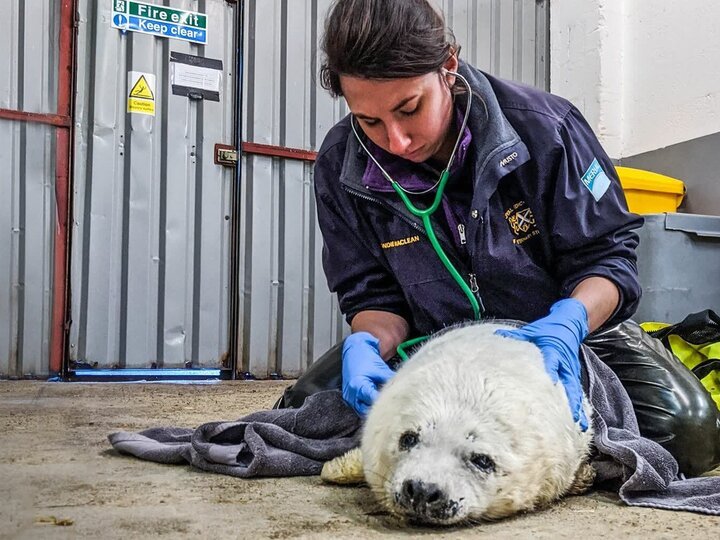
Locate an element on the screen. The height and width of the screenshot is (540, 720). cloth is located at coordinates (119, 432).